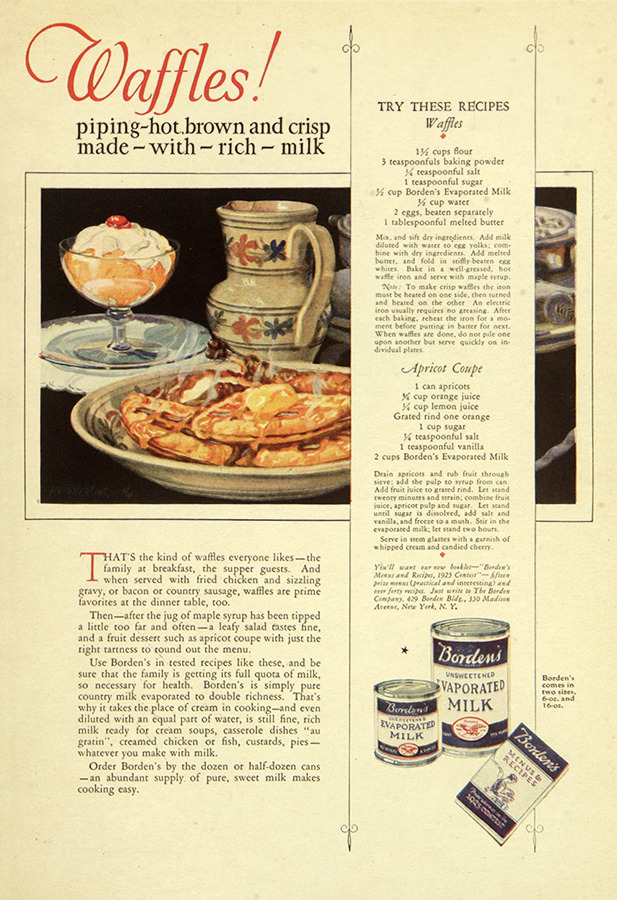
Locate an element on the screen. Image resolution: width=617 pixels, height=900 pixels. dishes is located at coordinates (91, 354), (178, 472), (555, 291), (81, 382), (138, 285).